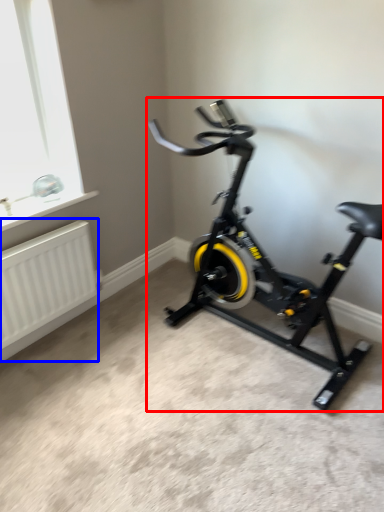
Question: Which point is further to the camera, stationary bicycle (highlighted by a red box) or radiator (highlighted by a blue box)?

Choices:
 (A) stationary bicycle
 (B) radiator

Answer: (B)